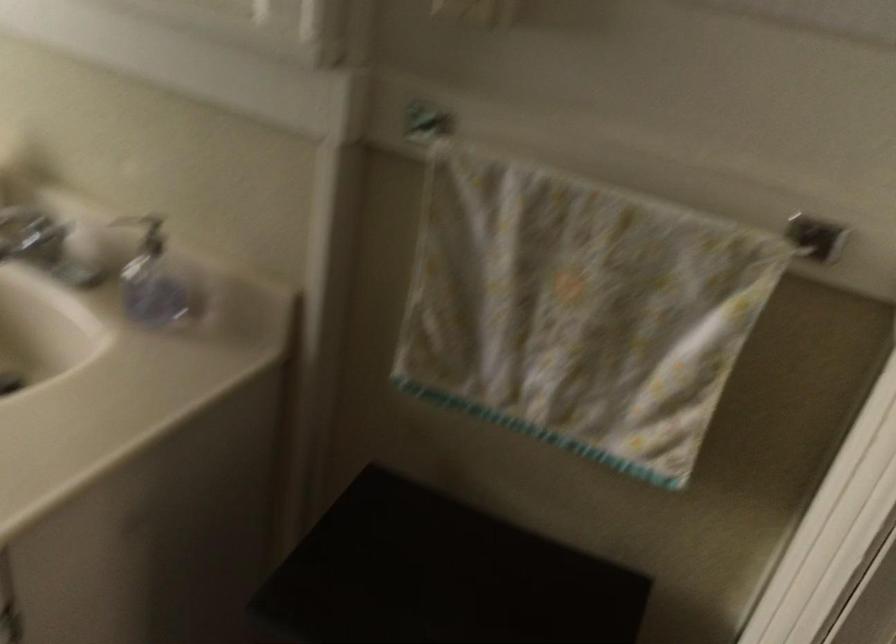
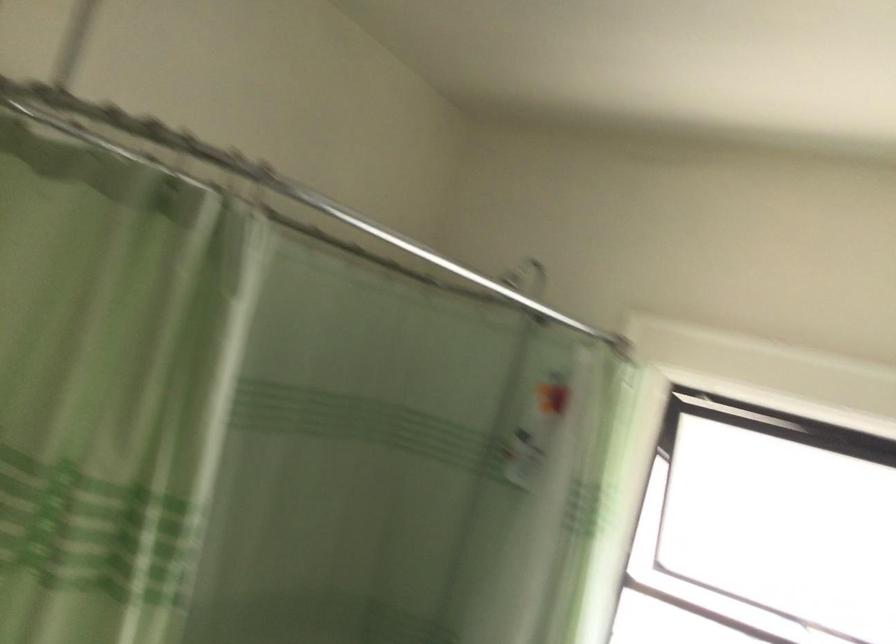
Question: The images are taken continuously from a first-person perspective. In which direction is your viewpoint rotating?

Choices:
 (A) Left
 (B) Right
 (C) Up
 (D) Down

Answer: (A)